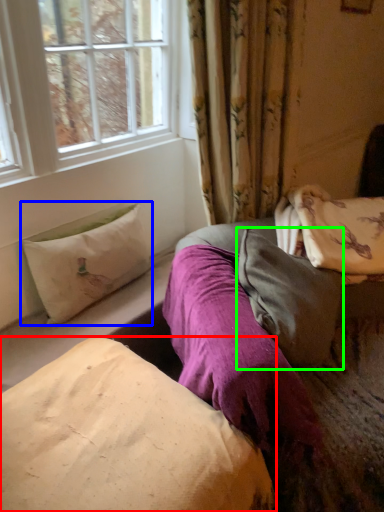
Question: Based on their relative distances, which object is nearer to pillow (highlighted by a red box)? Choose from pillow (highlighted by a blue box) and pillow (highlighted by a green box).

Choices:
 (A) pillow
 (B) pillow

Answer: (B)